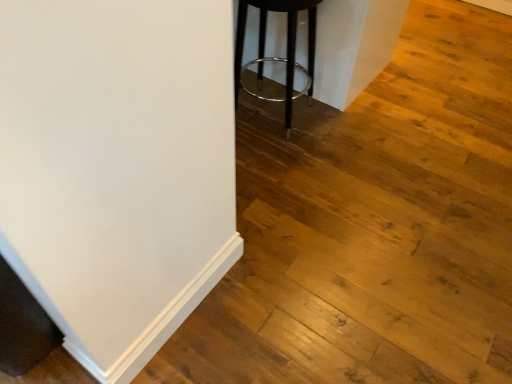
This screenshot has width=512, height=384. In order to click on unoccupied area in front of black metal stool at center in this screenshot , I will do `click(282, 163)`.